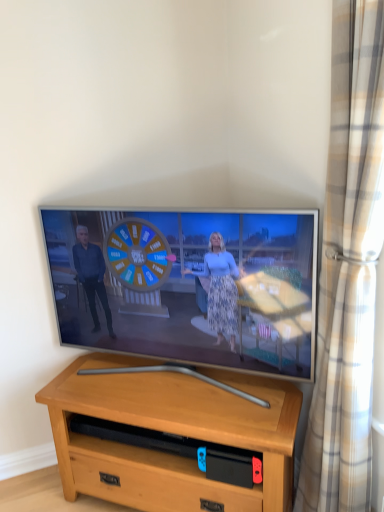
Measure the distance between point (330, 423) and camera.

Point (330, 423) and camera are 1.40 meters apart from each other.

The width and height of the screenshot is (384, 512). Describe the element at coordinates (187, 285) in the screenshot. I see `flat screen tv at center` at that location.

What do you see at coordinates (171, 432) in the screenshot?
I see `light brown wood desk at center` at bounding box center [171, 432].

Identify the location of beige plaid curtain at right. (348, 269).

Would you say flat screen tv at center is inside or outside light brown wood desk at center?

The correct answer is: outside.

Considering their positions, is flat screen tv at center located in front of or behind light brown wood desk at center?

Visually, flat screen tv at center is located in front of light brown wood desk at center.

Could you tell me if flat screen tv at center is turned towards light brown wood desk at center?

No, flat screen tv at center is not aimed at light brown wood desk at center.

Considering the relative sizes of flat screen tv at center and light brown wood desk at center in the image provided, is flat screen tv at center thinner than light brown wood desk at center?

Indeed, flat screen tv at center has a lesser width compared to light brown wood desk at center.

Is beige plaid curtain at right wider or thinner than light brown wood desk at center?

Clearly, beige plaid curtain at right has less width compared to light brown wood desk at center.

Does point (336, 365) come behind point (246, 379)?

No, (336, 365) is closer to viewer.

Considering the sizes of objects beige plaid curtain at right and light brown wood desk at center in the image provided, who is shorter, beige plaid curtain at right or light brown wood desk at center?

With less height is light brown wood desk at center.

At what (x,y) coordinates should I click in order to perform the action: click on desk below the beige plaid curtain at right (from the image's perspective). Please return your answer as a coordinate pair (x, y). Looking at the image, I should click on point(171,432).

Is flat screen tv at center at the back of beige plaid curtain at right?

No, beige plaid curtain at right is not facing the opposite direction of flat screen tv at center.

Can you confirm if beige plaid curtain at right is shorter than flat screen tv at center?

No, beige plaid curtain at right is not shorter than flat screen tv at center.

Which of these two, beige plaid curtain at right or flat screen tv at center, is wider?

flat screen tv at center.

Which of these two, flat screen tv at center or beige plaid curtain at right, stands taller?

beige plaid curtain at right.

Can you tell me how much flat screen tv at center and beige plaid curtain at right differ in facing direction?

48.5 degrees.

Is flat screen tv at center facing away from beige plaid curtain at right?

No, flat screen tv at center is not facing away from beige plaid curtain at right.

Measure the distance between light brown wood desk at center and flat screen tv at center.

13.64 inches.

Looking at their sizes, would you say light brown wood desk at center is wider or thinner than flat screen tv at center?

light brown wood desk at center is wider than flat screen tv at center.

Is light brown wood desk at center touching flat screen tv at center?

light brown wood desk at center and flat screen tv at center are not in contact.

Consider the image. How many degrees apart are the facing directions of light brown wood desk at center and flat screen tv at center?

They differ by 0.357 degrees in their facing directions.

Looking at this image, from the image's perspective, which one is positioned lower, light brown wood desk at center or beige plaid curtain at right?

light brown wood desk at center.

Find the location of a particular element. The width and height of the screenshot is (384, 512). curtain above the light brown wood desk at center (from the image's perspective) is located at coordinates (348, 269).

Considering the sizes of light brown wood desk at center and beige plaid curtain at right in the image, is light brown wood desk at center bigger or smaller than beige plaid curtain at right?

Clearly, light brown wood desk at center is larger in size than beige plaid curtain at right.

You are a GUI agent. You are given a task and a screenshot of the screen. Output one action in this format:
    pyautogui.click(x=<x>, y=<y>)
    Task: Click on the desk lying behind the flat screen tv at center
    
    Given the screenshot: What is the action you would take?
    pyautogui.click(x=171, y=432)

The height and width of the screenshot is (512, 384). In order to click on desk that is under the beige plaid curtain at right (from a real-world perspective) in this screenshot , I will do `click(171, 432)`.

Estimate the real-world distances between objects in this image. Which object is further from flat screen tv at center, light brown wood desk at center or beige plaid curtain at right?

beige plaid curtain at right is further to flat screen tv at center.

Considering their positions, is flat screen tv at center positioned closer to beige plaid curtain at right than light brown wood desk at center?

flat screen tv at center lies closer to beige plaid curtain at right than the other object.

Estimate the real-world distances between objects in this image. Which object is further from beige plaid curtain at right, light brown wood desk at center or flat screen tv at center?

light brown wood desk at center is positioned further to the anchor beige plaid curtain at right.

Estimate the real-world distances between objects in this image. Which object is closer to light brown wood desk at center, beige plaid curtain at right or flat screen tv at center?

flat screen tv at center.

When comparing their distances from light brown wood desk at center, does flat screen tv at center or beige plaid curtain at right seem closer?

Among the two, flat screen tv at center is located nearer to light brown wood desk at center.

When comparing their distances from flat screen tv at center, does beige plaid curtain at right or light brown wood desk at center seem further?

beige plaid curtain at right is positioned further to the anchor flat screen tv at center.

Where is `curtain between flat screen tv at center and light brown wood desk at center from top to bottom`? curtain between flat screen tv at center and light brown wood desk at center from top to bottom is located at coordinates (348, 269).